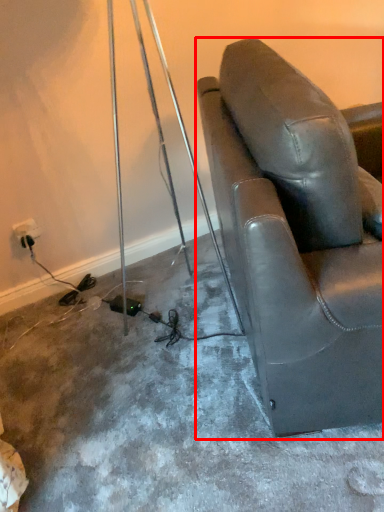
Question: From the image's perspective, considering the relative positions of chair (annotated by the red box) and electric outlet in the image provided, where is chair (annotated by the red box) located with respect to the staircase?

Choices:
 (A) below
 (B) above

Answer: (B)